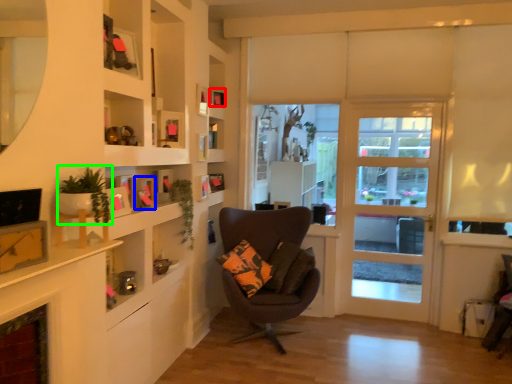
Question: Estimate the real-world distances between objects in this image. Which object is closer to picture frame (highlighted by a red box), picture frame (highlighted by a blue box) or plant (highlighted by a green box)?

Choices:
 (A) picture frame
 (B) plant

Answer: (A)